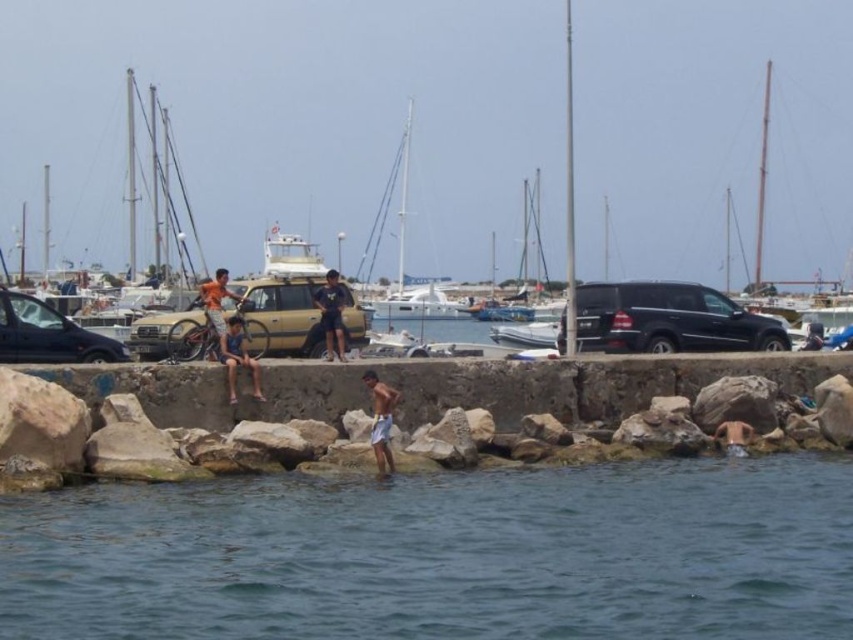
Who is more forward, (373,548) or (405,308)?

Point (373,548)

Who is more distant from viewer, [416,496] or [392,317]?

The point [392,317] is behind.

The width and height of the screenshot is (853, 640). I want to click on blue water at lower center, so click(440, 554).

Which is above, gold metallic suv at center or blue fabric shorts at center?

gold metallic suv at center is above.

In the scene shown: Is gold metallic suv at center smaller than blue fabric shorts at center?

No.

Describe the element at coordinates (279, 316) in the screenshot. This screenshot has height=640, width=853. I see `gold metallic suv at center` at that location.

You are a GUI agent. You are given a task and a screenshot of the screen. Output one action in this format:
    pyautogui.click(x=<x>, y=<y>)
    Task: Click on the gold metallic suv at center
    The width and height of the screenshot is (853, 640).
    Given the screenshot: What is the action you would take?
    pyautogui.click(x=279, y=316)

Describe the element at coordinates (279, 316) in the screenshot. The height and width of the screenshot is (640, 853). I see `gold metallic suv at center` at that location.

This screenshot has height=640, width=853. I want to click on gold metallic suv at center, so click(x=279, y=316).

Which is behind, point (294, 292) or point (419, 310)?

The point (419, 310) is behind.

Find the location of `gold metallic suv at center`. gold metallic suv at center is located at coordinates (279, 316).